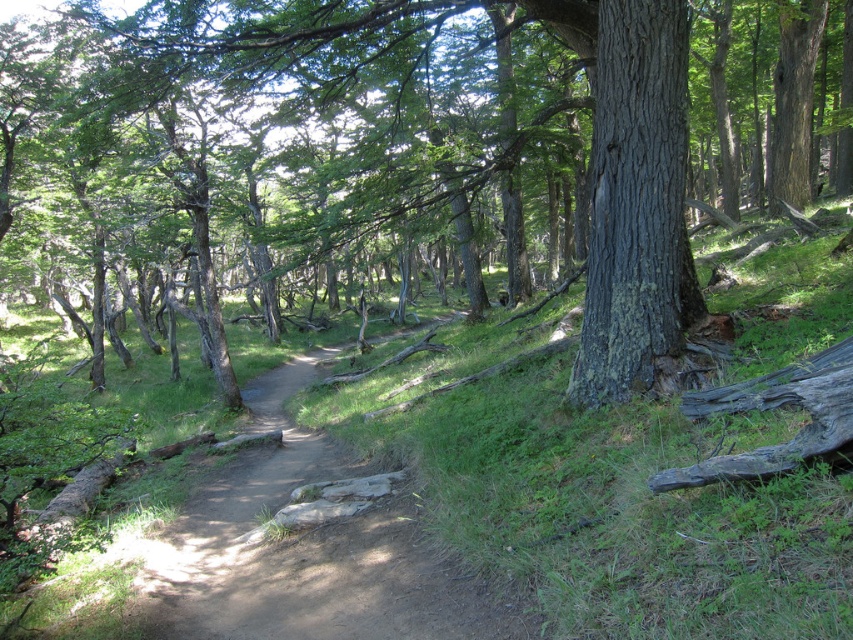
Between rough bark tree at center and charcoal rough log at right, which one is positioned lower?

Positioned lower is charcoal rough log at right.

Does point (163, 124) come in front of point (804, 448)?

No.

At what (x,y) coordinates should I click in order to perform the action: click on rough bark tree at center. Please return your answer as a coordinate pair (x, y). The width and height of the screenshot is (853, 640). Looking at the image, I should click on (424, 140).

Does rough bark tree at center appear on the right side of dark gray bark tree at center?

No, rough bark tree at center is not to the right of dark gray bark tree at center.

Can you confirm if rough bark tree at center is positioned to the left of dark gray bark tree at center?

Correct, you'll find rough bark tree at center to the left of dark gray bark tree at center.

Identify the location of rough bark tree at center. (424, 140).

Where is `rough bark tree at center`? This screenshot has width=853, height=640. rough bark tree at center is located at coordinates (424, 140).

Who is positioned more to the left, dark gray bark tree at center or charcoal rough log at right?

charcoal rough log at right

Is dark gray bark tree at center positioned behind charcoal rough log at right?

Yes.

The width and height of the screenshot is (853, 640). I want to click on dark gray bark tree at center, so click(637, 209).